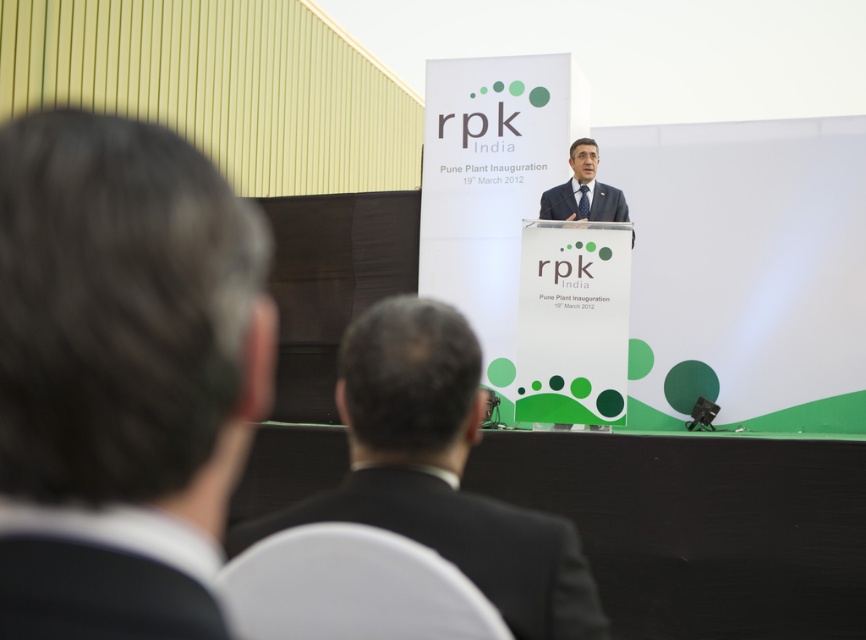
Who is higher up, dark brown hair at left or dark gray suit at center?

dark gray suit at center is higher up.

Does point (215, 173) come behind point (570, 150)?

No, (215, 173) is closer to viewer.

Does point (95, 314) lie in front of point (593, 144)?

That is True.

The width and height of the screenshot is (866, 640). I want to click on dark brown hair at left, so click(126, 317).

Between black matte suit at lower left and dark gray suit at center, which one is positioned higher?

Positioned higher is dark gray suit at center.

Does black matte suit at lower left have a lesser height compared to dark gray suit at center?

Yes.

Between point (169, 550) and point (632, 236), which one is positioned behind?

Point (632, 236)

Locate an element on the screen. The image size is (866, 640). black matte suit at lower left is located at coordinates (104, 573).

Does dark brown hair at left have a larger size compared to black suit at center?

Actually, dark brown hair at left might be smaller than black suit at center.

Is the position of dark brown hair at left less distant than that of black suit at center?

That is True.

Is point (127, 612) positioned behind point (256, 536)?

No.

The image size is (866, 640). I want to click on dark brown hair at left, so click(x=126, y=317).